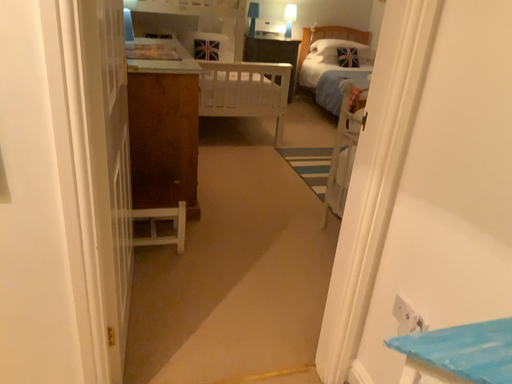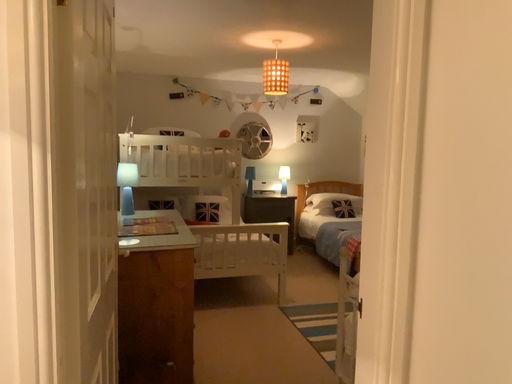
Question: Which way did the camera rotate in the video?

Choices:
 (A) rotated upward
 (B) rotated downward

Answer: (A)